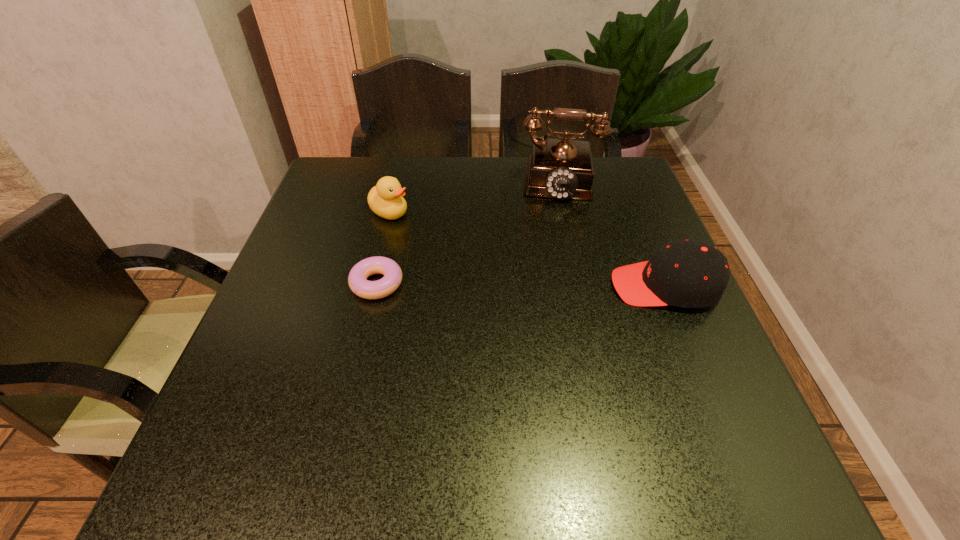
Where is `free location located on the face of the duckling`? free location located on the face of the duckling is located at coordinates (476, 258).

This screenshot has width=960, height=540. In order to click on blank space located 0.140m on the dial of the telephone in this screenshot , I will do `click(549, 237)`.

Locate an element on the screen. The image size is (960, 540). free space located on the dial of the telephone is located at coordinates (547, 285).

Where is `vacant space located on the dial of the telephone`? The height and width of the screenshot is (540, 960). vacant space located on the dial of the telephone is located at coordinates (548, 244).

You are a GUI agent. You are given a task and a screenshot of the screen. Output one action in this format:
    pyautogui.click(x=<x>, y=<y>)
    Task: Click on the duckling that is at the far edge
    
    Given the screenshot: What is the action you would take?
    pyautogui.click(x=385, y=199)

The image size is (960, 540). Identify the location of telephone present at the far edge. (562, 168).

Identify the location of cap located in the right edge section of the desktop. Image resolution: width=960 pixels, height=540 pixels. (689, 274).

At what (x,y) coordinates should I click in order to perform the action: click on telephone that is at the right edge. Please return your answer as a coordinate pair (x, y). This screenshot has height=540, width=960. Looking at the image, I should click on (562, 168).

What are the coordinates of `object that is at the far right corner` in the screenshot? It's located at (562, 168).

You are a GUI agent. You are given a task and a screenshot of the screen. Output one action in this format:
    pyautogui.click(x=<x>, y=<y>)
    Task: Click on the vacant region at the far edge of the desktop
    Image resolution: width=960 pixels, height=540 pixels.
    Given the screenshot: What is the action you would take?
    pyautogui.click(x=491, y=200)